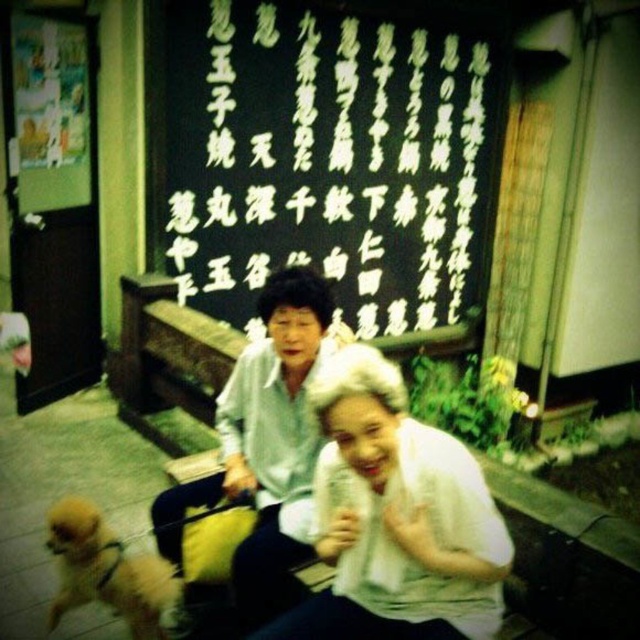
Who is shorter, black matte signboard at upper center or white sheer fabric at center?

white sheer fabric at center

Does black matte signboard at upper center have a greater width compared to white sheer fabric at center?

Correct, the width of black matte signboard at upper center exceeds that of white sheer fabric at center.

Is point (374, 26) closer to viewer compared to point (358, 637)?

No, (374, 26) is further to viewer.

Find the location of a particular element. black matte signboard at upper center is located at coordinates (330, 157).

Does white sheer fabric at center appear over golden fur dog at lower left?

Indeed, white sheer fabric at center is positioned over golden fur dog at lower left.

Between point (388, 605) and point (88, 509), which one is positioned behind?

Point (88, 509)

Does point (356, 621) come in front of point (102, 564)?

Yes, it is.

At what (x,y) coordinates should I click in order to perform the action: click on white sheer fabric at center. Please return your answer as a coordinate pair (x, y). Looking at the image, I should click on pos(396,518).

Is white matte shirt at center to the right of golden fur dog at lower left from the viewer's perspective?

Correct, you'll find white matte shirt at center to the right of golden fur dog at lower left.

Between white matte shirt at center and golden fur dog at lower left, which one has less height?

golden fur dog at lower left

You are a GUI agent. You are given a task and a screenshot of the screen. Output one action in this format:
    pyautogui.click(x=<x>, y=<y>)
    Task: Click on the white matte shirt at center
    
    Given the screenshot: What is the action you would take?
    pyautogui.click(x=262, y=445)

Locate an element on the screen. white matte shirt at center is located at coordinates (262, 445).